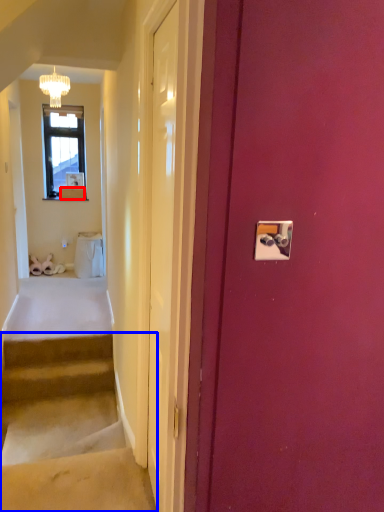
Question: Which object appears farthest to the camera in this image, box (highlighted by a red box) or stairs (highlighted by a blue box)?

Choices:
 (A) box
 (B) stairs

Answer: (A)